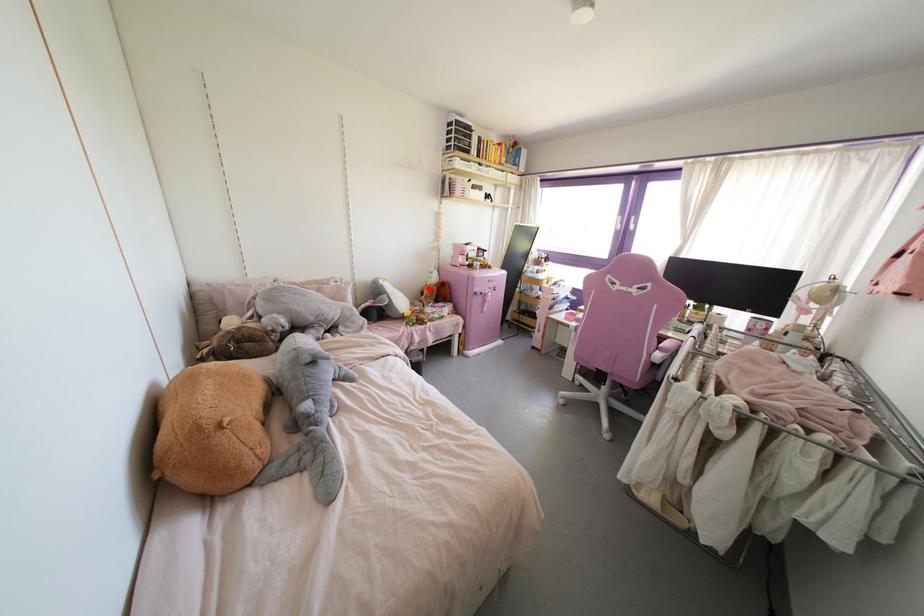
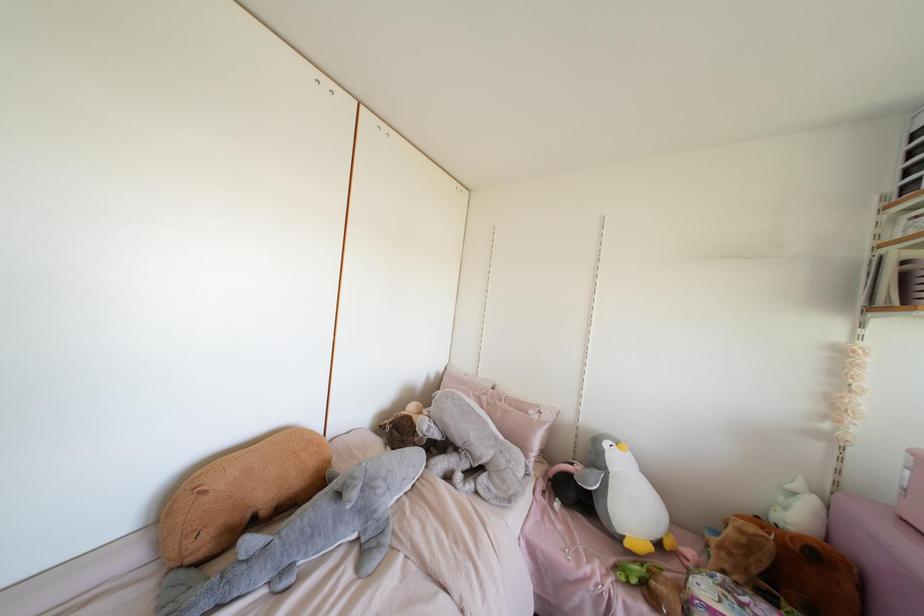
Find the pixel in the second image that matches the highlighted location in the first image.

(739, 531)